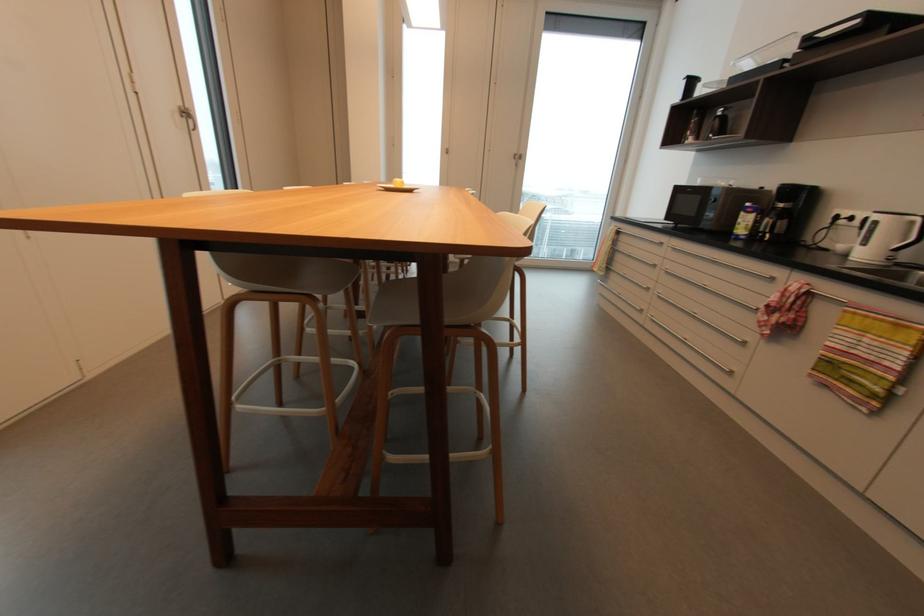
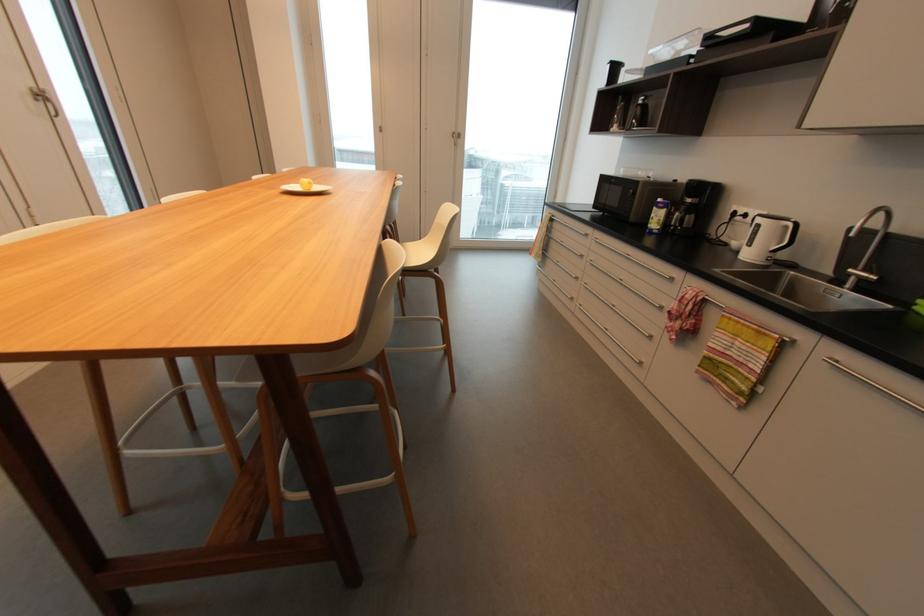
The point at (189, 114) is marked in the first image. Where is the corresponding point in the second image?

(49, 98)